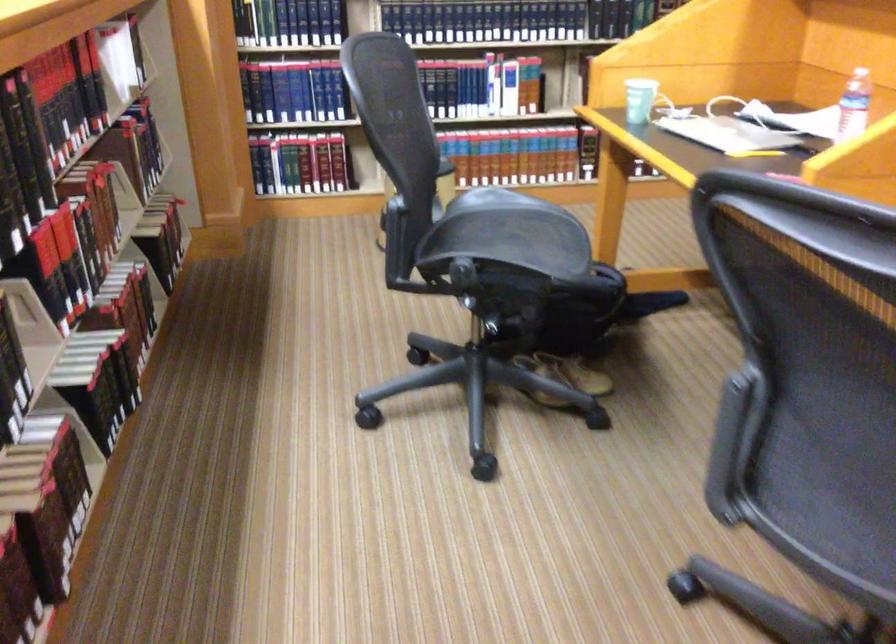
Where would you resting arm the chair armrest? Please return your answer as a coordinate pair (x, y).

(433, 272)